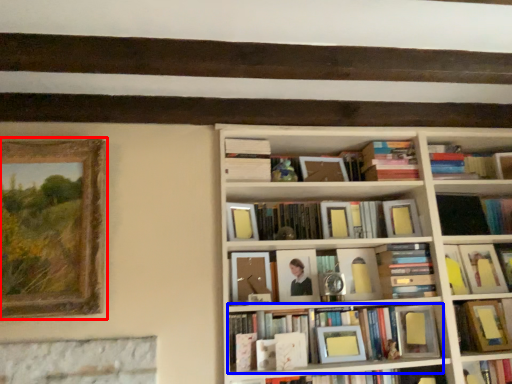
Question: Which point is closer to the camera, picture frame (highlighted by a red box) or book (highlighted by a blue box)?

Choices:
 (A) picture frame
 (B) book

Answer: (A)